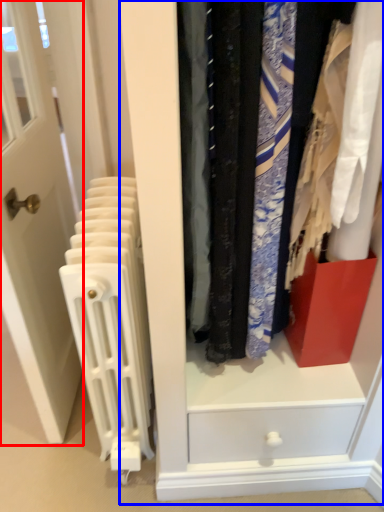
Question: Which object appears closest to the camera in this image, door (highlighted by a red box) or dresser (highlighted by a blue box)?

Choices:
 (A) door
 (B) dresser

Answer: (B)